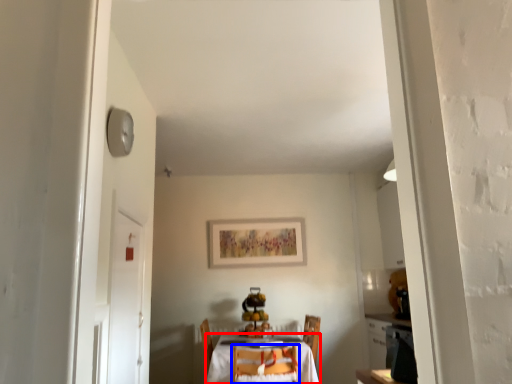
Question: Which object appears farthest to the camera in this image, table (highlighted by a red box) or chair (highlighted by a blue box)?

Choices:
 (A) table
 (B) chair

Answer: (A)